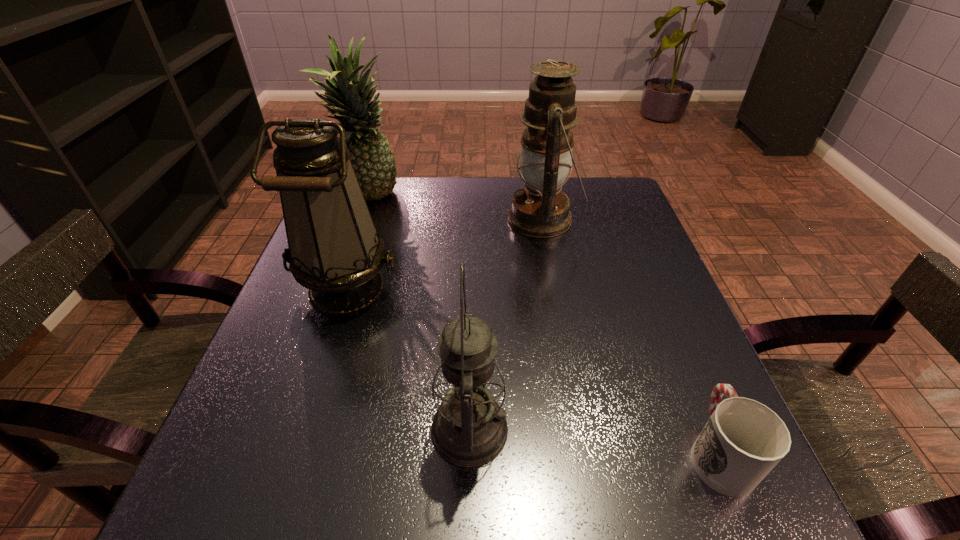
Locate an element on the screen. This screenshot has height=540, width=960. pineapple is located at coordinates (371, 155).

At what (x,y) coordinates should I click in order to perform the action: click on the rightmost oil lamp. Please return your answer as a coordinate pair (x, y). Image resolution: width=960 pixels, height=540 pixels. Looking at the image, I should click on (541, 210).

The image size is (960, 540). I want to click on the second object from right to left, so click(541, 210).

Locate an element on the screen. Image resolution: width=960 pixels, height=540 pixels. the leftmost oil lamp is located at coordinates (334, 250).

Where is `the third farthest object`? The height and width of the screenshot is (540, 960). the third farthest object is located at coordinates (334, 250).

Identify the location of the nearest oil lamp. The width and height of the screenshot is (960, 540). (469, 429).

Find the location of a particular element. The image size is (960, 540). the second oil lamp from right to left is located at coordinates (469, 429).

Image resolution: width=960 pixels, height=540 pixels. Find the location of `the rightmost object`. the rightmost object is located at coordinates (743, 440).

You are a GUI agent. You are given a task and a screenshot of the screen. Output one action in this format:
    pyautogui.click(x=<x>, y=<y>)
    Task: Click on the shortest object
    
    Given the screenshot: What is the action you would take?
    pyautogui.click(x=743, y=440)

Where is `vacant space located on the right of the pineapple`? vacant space located on the right of the pineapple is located at coordinates (478, 197).